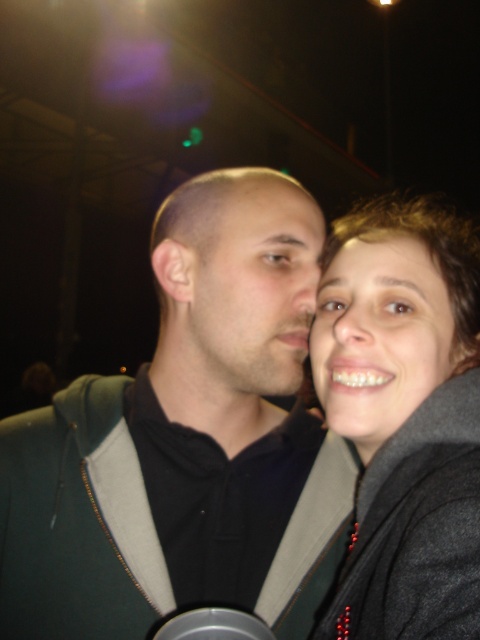
Question: Which point appears farthest from the camera in this image?

Choices:
 (A) (148, 385)
 (B) (291, 298)

Answer: (A)

Question: Can you confirm if gray woolen jacket at upper right is bigger than smooth skin face at center?

Choices:
 (A) no
 (B) yes

Answer: (B)

Question: Which of the following is the closest to the observer?

Choices:
 (A) matte black face at center
 (B) dark green hoodie at center
 (C) gray woolen jacket at upper right

Answer: (C)

Question: Based on their relative distances, which object is farther from the gray woolen jacket at upper right?

Choices:
 (A) metallic silver cup at center
 (B) dark green hoodie at center
 (C) matte black face at center

Answer: (A)

Question: Where is gray woolen jacket at upper right located in relation to metallic silver cup at center in the image?

Choices:
 (A) left
 (B) right

Answer: (B)

Question: Is dark green hoodie at center smaller than matte black face at center?

Choices:
 (A) yes
 (B) no

Answer: (B)